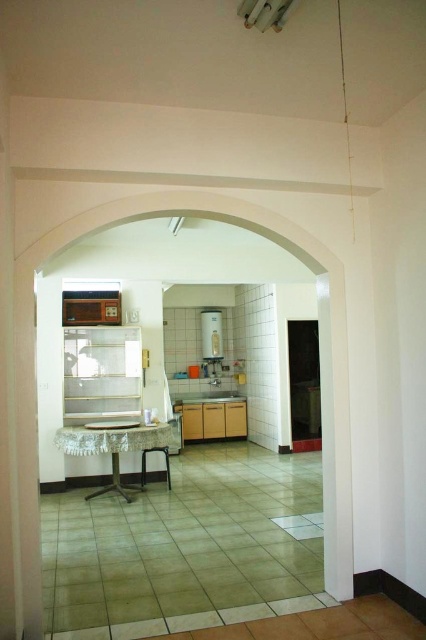
Who is positioned more to the right, white lace table at center or white glossy refrigerator at center?

white glossy refrigerator at center

Locate an element on the screen. white lace table at center is located at coordinates (115, 449).